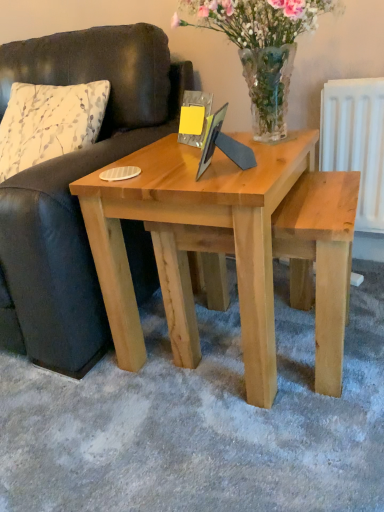
This screenshot has width=384, height=512. I want to click on vacant space situated above natural wood coffee table at center (from a real-world perspective), so click(x=187, y=161).